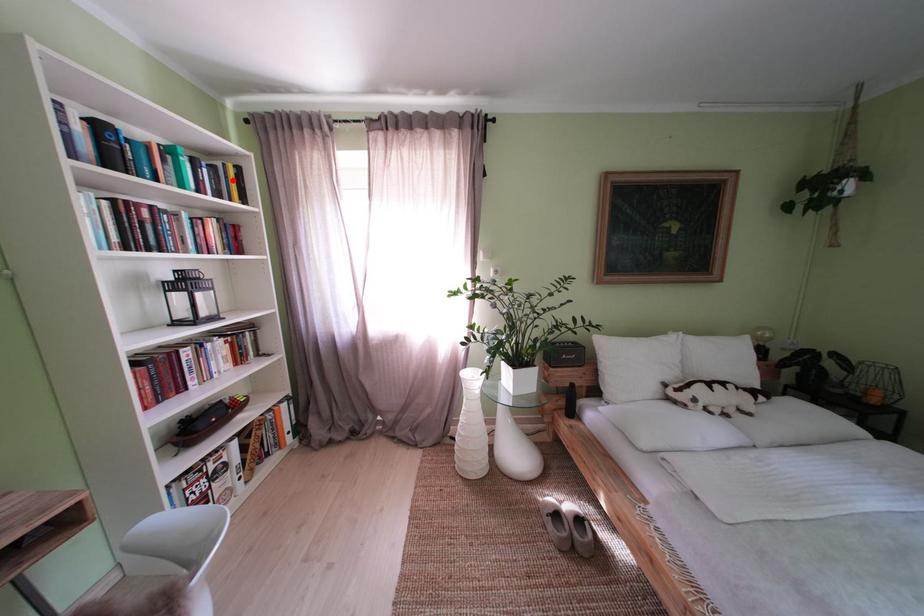
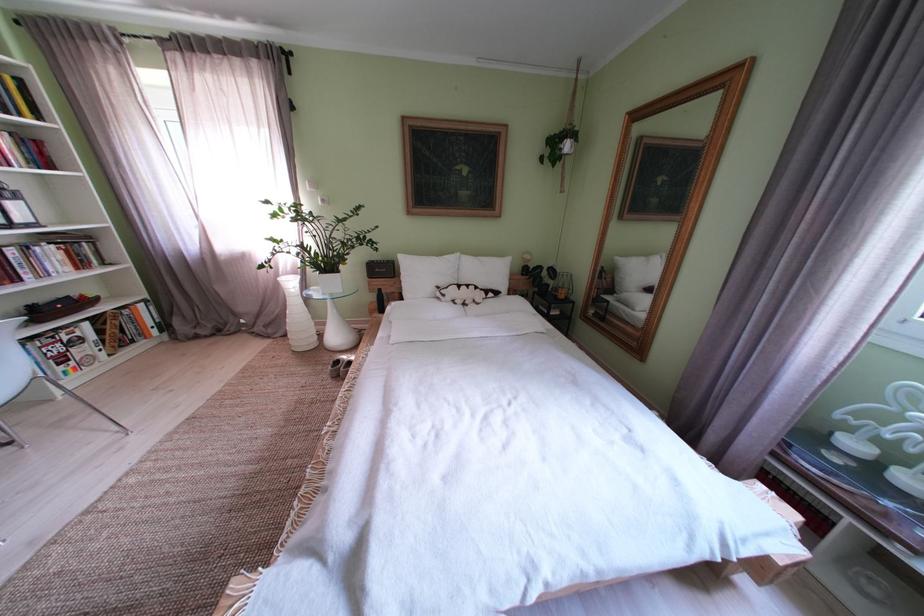
Question: I am providing you with two images of the same scene from different viewpoints. Given a red point in image1, look at the same physical point in image2. Is it:

Choices:
 (A) Closer to the viewpoint
 (B) Farther from the viewpoint

Answer: (B)